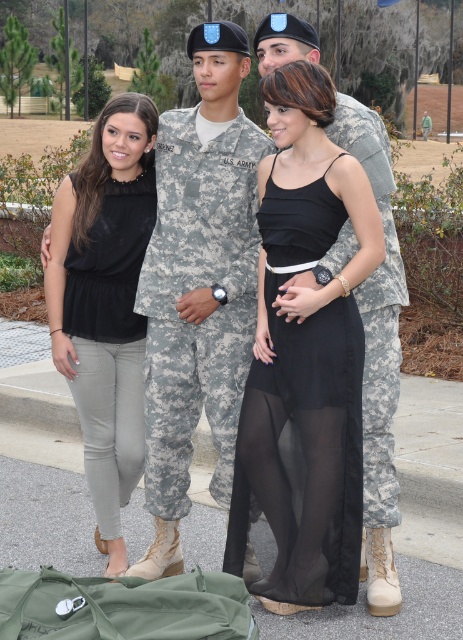
Question: Which object is positioned closest to the camouflage fabric us army uniform at center?

Choices:
 (A) camouflage uniform at center
 (B) matte black blouse at left

Answer: (A)

Question: Which point appears closest to the camera in this image?

Choices:
 (A) (69, 221)
 (B) (225, 371)
 (C) (326, 435)

Answer: (C)

Question: Does camouflage fabric us army uniform at center appear on the left side of matte black blouse at left?

Choices:
 (A) yes
 (B) no

Answer: (B)

Question: Does camouflage uniform at center have a greater width compared to camouflage fabric us army uniform at center?

Choices:
 (A) no
 (B) yes

Answer: (B)

Question: Does black sheer dress at center have a greater width compared to matte black blouse at left?

Choices:
 (A) yes
 (B) no

Answer: (A)

Question: Based on their relative distances, which object is farther from the camouflage fabric us army uniform at center?

Choices:
 (A) matte black blouse at left
 (B) camouflage uniform at center

Answer: (A)